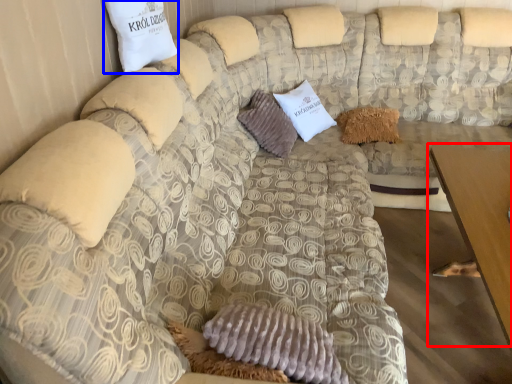
Question: Among these objects, which one is nearest to the camera, table (highlighted by a red box) or pillow (highlighted by a blue box)?

Choices:
 (A) table
 (B) pillow

Answer: (A)